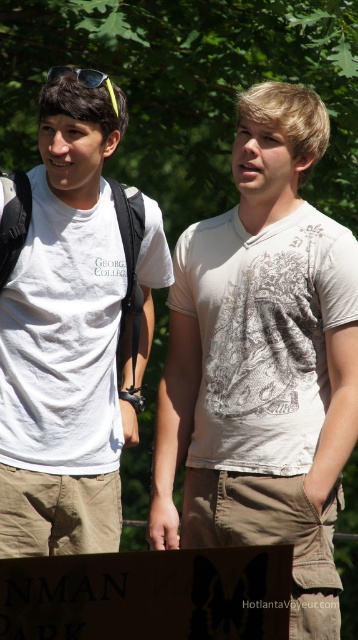
Based on the photo, which is below, white cotton t-shirt at left or sunglassestransparent at left?

Positioned lower is white cotton t-shirt at left.

Is white cotton t-shirt at left bigger than sunglassestransparent at left?

Indeed, white cotton t-shirt at left has a larger size compared to sunglassestransparent at left.

What do you see at coordinates (73, 333) in the screenshot?
I see `white cotton t-shirt at left` at bounding box center [73, 333].

This screenshot has height=640, width=358. Find the location of `white cotton t-shirt at left`. white cotton t-shirt at left is located at coordinates (73, 333).

Which of these two, white cotton shirt at center or sunglassestransparent at left, stands taller?

Standing taller between the two is white cotton shirt at center.

Does white cotton shirt at center have a smaller size compared to sunglassestransparent at left?

No.

Where is `white cotton shirt at center`? This screenshot has height=640, width=358. white cotton shirt at center is located at coordinates (263, 362).

Between white cotton shirt at center and white cotton t-shirt at left, which one has less height?

white cotton t-shirt at left is shorter.

Between white cotton shirt at center and white cotton t-shirt at left, which one is positioned higher?

white cotton t-shirt at left is above.

The width and height of the screenshot is (358, 640). What are the coordinates of `white cotton shirt at center` in the screenshot? It's located at (263, 362).